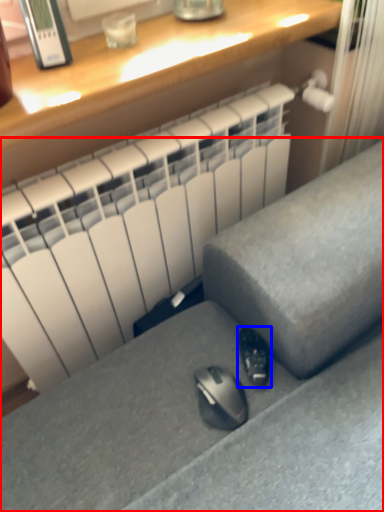
Question: Which object is closer to the camera taking this photo, furniture (highlighted by a red box) or shoe (highlighted by a blue box)?

Choices:
 (A) furniture
 (B) shoe

Answer: (A)